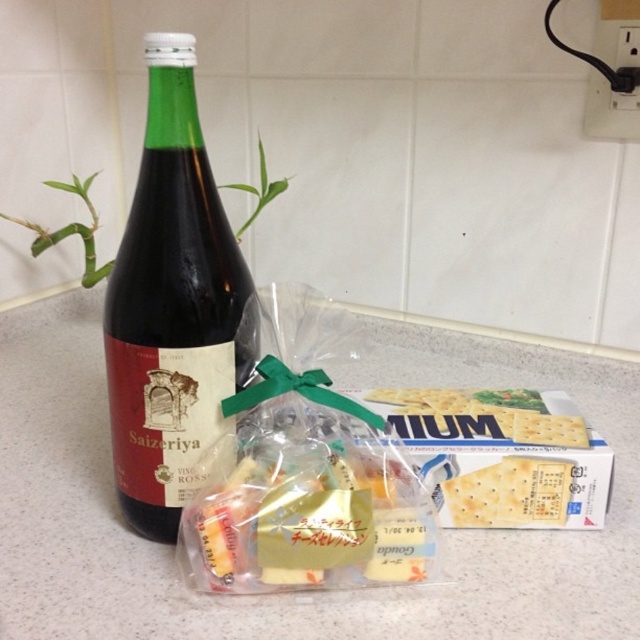
You are planning to serve snacks on a small plate that can only hold one item at a time. You have the white matte crackers at center and the light brown crisp at center. Which item should you choose if you want to serve the larger snack?

The white matte crackers at center is bigger than the light brown crisp at center, so you should choose the white matte crackers at center to serve the larger snack.

You are preparing a snack platter and have two items on the countertop. You need to place the white matte crackers at center and the light brown crisp at center in specific positions. According to the arrangement, which item is positioned to the left of the other?

The white matte crackers at center are positioned to the left of the light brown crisp at center.

You are standing at the center of the kitchen counter. There is a point located at coordinate (170, 305). Which object is this point on? Please answer with the object label from the scene description.

The point at coordinate (170, 305) is on the green glass bottle at left.